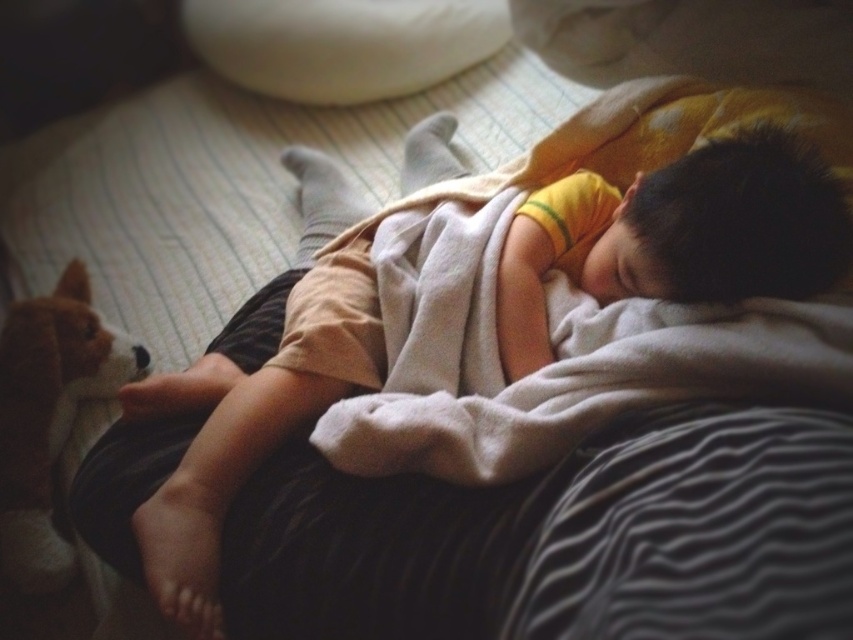
Does soft yellow shirt at center have a smaller size compared to brown plush dog at lower left?

No.

Does soft yellow shirt at center appear under brown plush dog at lower left?

Incorrect, soft yellow shirt at center is not positioned below brown plush dog at lower left.

What do you see at coordinates (242, 433) in the screenshot? I see `soft yellow shirt at center` at bounding box center [242, 433].

Where is `soft yellow shirt at center`? The height and width of the screenshot is (640, 853). soft yellow shirt at center is located at coordinates (242, 433).

Identify the location of soft yellow shirt at center. (242, 433).

How much distance is there between soft yellow shirt at center and white soft pillow at upper center?

soft yellow shirt at center and white soft pillow at upper center are 24.80 inches apart from each other.

Between point (646, 240) and point (433, 32), which one is positioned in front?

Point (646, 240) is in front.

Locate an element on the screen. The height and width of the screenshot is (640, 853). soft yellow shirt at center is located at coordinates (242, 433).

Does point (405, 61) come behind point (41, 449)?

That is True.

Who is more forward, (x=236, y=65) or (x=42, y=564)?

Positioned in front is point (x=42, y=564).

Locate an element on the screen. This screenshot has height=640, width=853. white soft pillow at upper center is located at coordinates (343, 44).